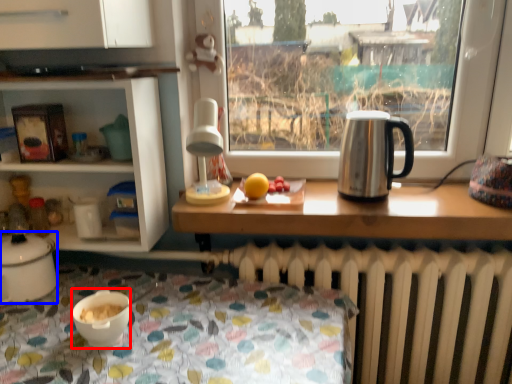
Question: Which object is further to the camera taking this photo, coffee cup (highlighted by a red box) or kitchen appliance (highlighted by a blue box)?

Choices:
 (A) coffee cup
 (B) kitchen appliance

Answer: (B)